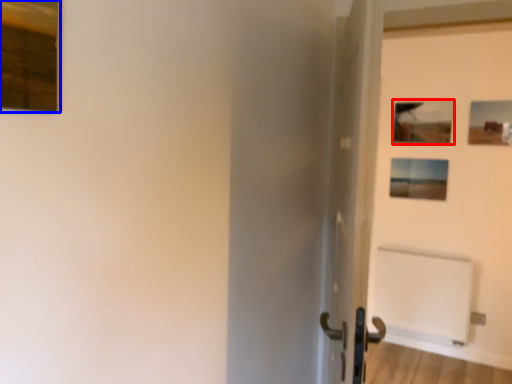
Question: Which of the following is the closest to the observer, picture frame (highlighted by a red box) or picture frame (highlighted by a blue box)?

Choices:
 (A) picture frame
 (B) picture frame

Answer: (B)